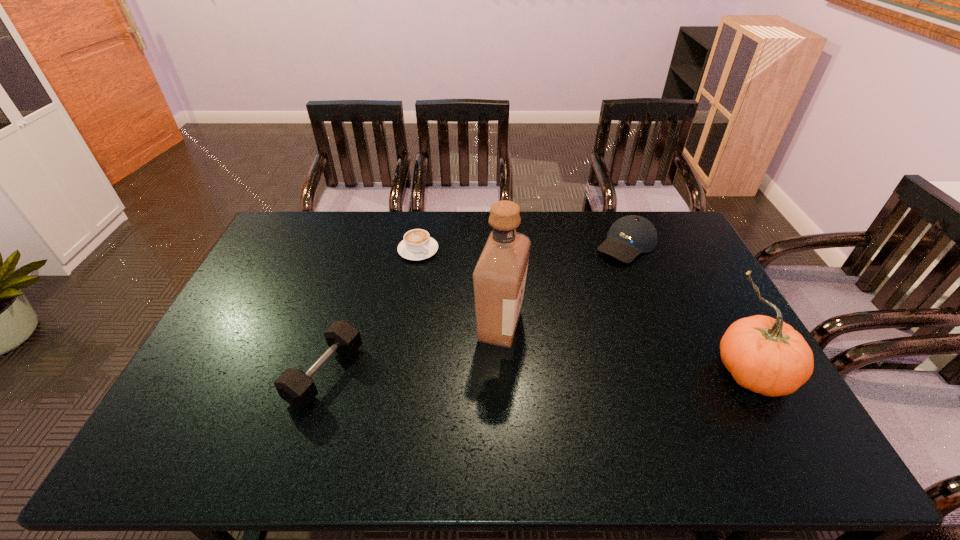
Find the location of a particular element. The width and height of the screenshot is (960, 540). the leftmost object is located at coordinates (297, 388).

This screenshot has width=960, height=540. I want to click on pumpkin, so click(x=765, y=355).

At what (x,y) coordinates should I click in order to perform the action: click on the tallest object. Please return your answer as a coordinate pair (x, y). Looking at the image, I should click on (499, 277).

Locate an element on the screen. This screenshot has width=960, height=540. liquor is located at coordinates (499, 277).

This screenshot has height=540, width=960. Find the location of `baseball cap`. baseball cap is located at coordinates (629, 236).

You are a GUI agent. You are given a task and a screenshot of the screen. Output one action in this format:
    pyautogui.click(x=<x>, y=<y>)
    Task: Click on the fourth object from right to left
    
    Given the screenshot: What is the action you would take?
    (x=417, y=245)

Identify the location of cappuccino. Image resolution: width=960 pixels, height=540 pixels. (417, 245).

At what (x,y) coordinates should I click in order to perform the action: click on vacant region located 0.060m on the left of the leftmost object. Please return your answer as a coordinate pair (x, y). This screenshot has height=540, width=960. Looking at the image, I should click on (270, 373).

This screenshot has height=540, width=960. Find the location of `blank space located on the back of the pumpkin`. blank space located on the back of the pumpkin is located at coordinates (691, 263).

The width and height of the screenshot is (960, 540). Identify the location of blank space located 0.160m on the front-facing side of the tallest object. (564, 380).